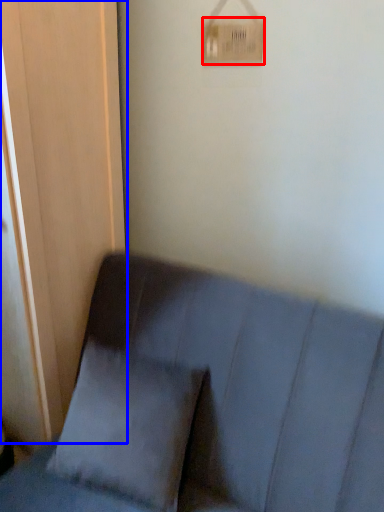
Question: Which of the following is the farthest to the observer, light switch (highlighted by a red box) or screen door (highlighted by a blue box)?

Choices:
 (A) light switch
 (B) screen door

Answer: (A)